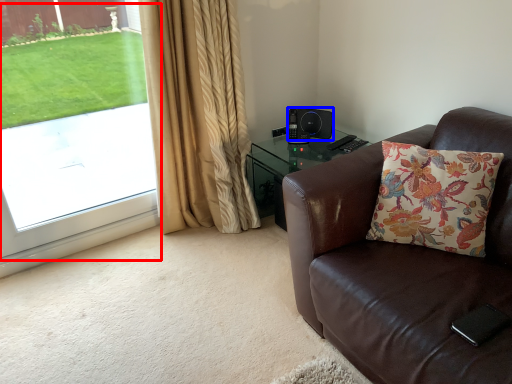
Question: Which of the following is the closest to the observer, window screen (highlighted by a red box) or speaker (highlighted by a blue box)?

Choices:
 (A) window screen
 (B) speaker

Answer: (A)